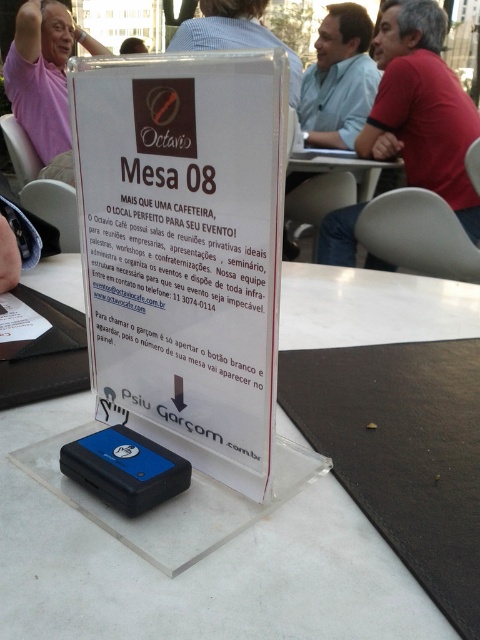
Question: Is red shirt at upper right in front of pink fabric shirt at upper left?

Choices:
 (A) no
 (B) yes

Answer: (B)

Question: Does clear plastic sign at center appear under matte blue shirt at upper center?

Choices:
 (A) yes
 (B) no

Answer: (A)

Question: Which point is closer to the camera?

Choices:
 (A) (76, 301)
 (B) (141, 38)
 (C) (276, 42)

Answer: (A)

Question: Considering the real-world distances, which object is farthest from the matte blue shirt at upper center?

Choices:
 (A) red shirt at upper right
 (B) light blue shirt at upper center
 (C) clear plastic sign at center

Answer: (C)

Question: Which point appears closest to the camera in this image?

Choices:
 (A) (175, 445)
 (B) (232, 44)
 (C) (370, 83)
 (D) (11, 90)

Answer: (A)

Question: Where is clear plastic sign at center located in relation to red shirt at upper right in the image?

Choices:
 (A) above
 (B) below

Answer: (B)